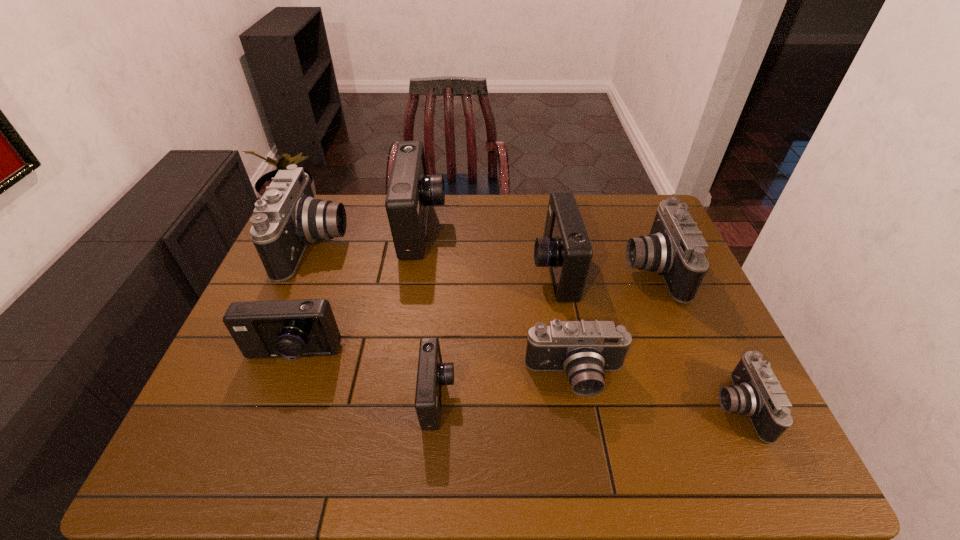
You are a GUI agent. You are given a task and a screenshot of the screen. Output one action in this format:
    pyautogui.click(x=<x>, y=<y>)
    Task: Click on the empty location between the third biggest black camera and the biggest black camera
    The width and height of the screenshot is (960, 540).
    Given the screenshot: What is the action you would take?
    pyautogui.click(x=445, y=312)

Locate an element on the screen. The height and width of the screenshot is (540, 960). empty space between the biggest blue camera and the third biggest blue camera is located at coordinates (357, 292).

Locate an element on the screen. free space that is in between the biggest blue camera and the rightmost blue camera is located at coordinates (488, 249).

Find the location of a particular element. empty location between the second black camera from left to right and the smallest blue camera is located at coordinates (507, 388).

Where is `vacant area between the second black camera from left to right and the smallest blue camera`? Image resolution: width=960 pixels, height=540 pixels. vacant area between the second black camera from left to right and the smallest blue camera is located at coordinates (507, 388).

Where is `vacant space in between the biggest blue camera and the leftmost black camera`? vacant space in between the biggest blue camera and the leftmost black camera is located at coordinates (369, 237).

Where is `empty space that is in between the biggest blue camera and the second biggest blue camera`? Image resolution: width=960 pixels, height=540 pixels. empty space that is in between the biggest blue camera and the second biggest blue camera is located at coordinates tap(488, 249).

The image size is (960, 540). I want to click on free spot between the rightmost blue camera and the leftmost blue camera, so click(x=422, y=313).

Select which object appears as the fourth closest to the rightmost blue camera. Please provide its 2D coordinates. Your answer should be formatted as a tuple, i.e. [(x, y)], where the tuple contains the x and y coordinates of a point satisfying the conditions above.

[(432, 373)]

Identify the location of object that can be found as the third closest to the leftmost blue camera. (411, 191).